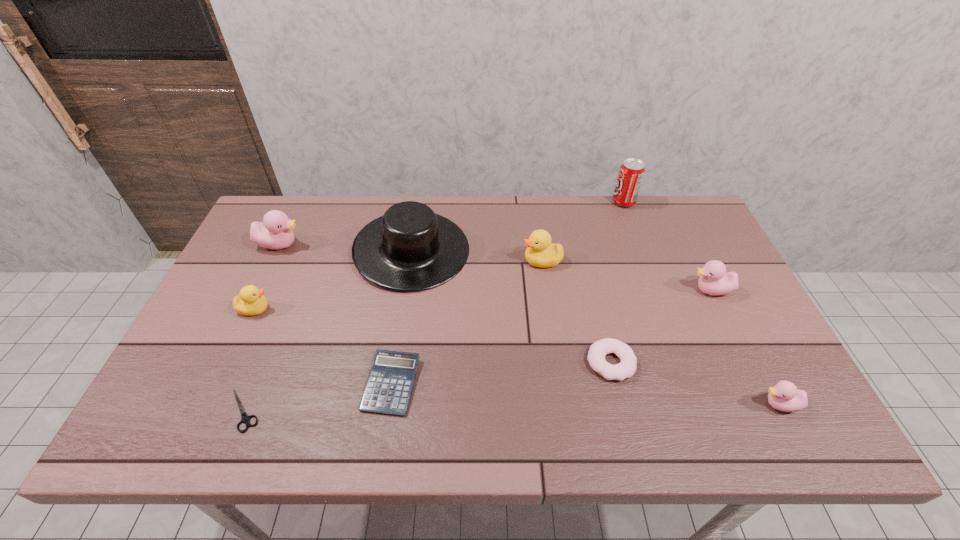
Image resolution: width=960 pixels, height=540 pixels. What are the coordinates of `vacant space that's between the shears and the eighth tallest object` in the screenshot? It's located at (427, 387).

I want to click on unoccupied area between the nearest pink duckling and the black shears, so click(512, 408).

Find the location of a particular element. The width and height of the screenshot is (960, 540). vacant area that lies between the shears and the soda is located at coordinates (434, 306).

This screenshot has height=540, width=960. I want to click on free space between the fifth object from right to left and the shortest object, so click(393, 336).

This screenshot has height=540, width=960. In order to click on free space between the shears and the eighth tallest object in this screenshot , I will do `click(427, 387)`.

The width and height of the screenshot is (960, 540). Identify the location of empty space that is in between the soda and the shortest object. (434, 306).

Identify the location of object that is the fifth closest to the second biggest pink duckling. This screenshot has width=960, height=540. (410, 248).

This screenshot has height=540, width=960. Identify the location of object identified as the fourth closest to the fifth object from right to left. (714, 280).

In order to click on duckling that is the closest to the second smallest pink duckling in this screenshot , I will do `click(784, 396)`.

Choose which duckling is the second nearest neighbor to the farthest object. Please provide its 2D coordinates. Your answer should be formatted as a tuple, i.e. [(x, y)], where the tuple contains the x and y coordinates of a point satisfying the conditions above.

[(714, 280)]